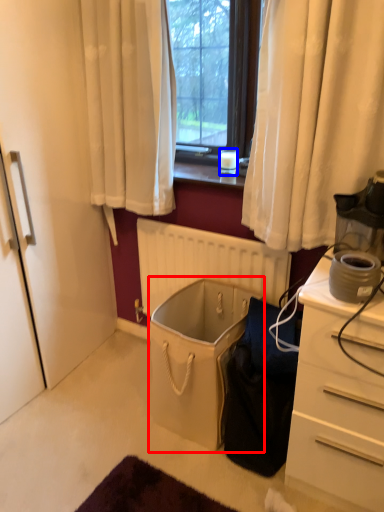
Question: Which point is further to the camera, laundry basket (highlighted by a red box) or coffee cup (highlighted by a blue box)?

Choices:
 (A) laundry basket
 (B) coffee cup

Answer: (B)